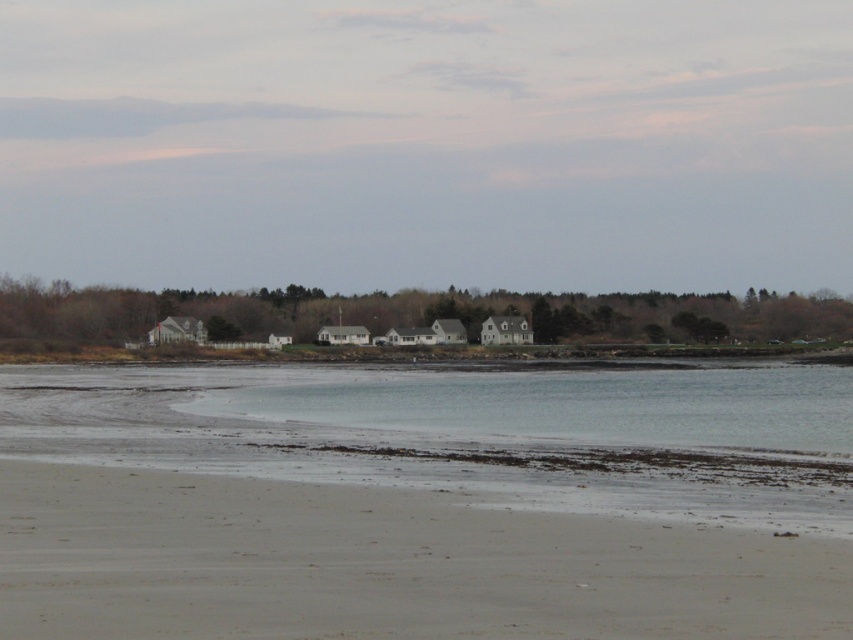
Question: Can you confirm if sandy beach at lower left is thinner than clear water at lower center?

Choices:
 (A) yes
 (B) no

Answer: (A)

Question: Does sandy beach at lower left appear over clear water at lower center?

Choices:
 (A) yes
 (B) no

Answer: (A)

Question: Which point is closer to the camera?

Choices:
 (A) clear water at lower center
 (B) sandy beach at lower left

Answer: (B)

Question: Does sandy beach at lower left have a lesser width compared to clear water at lower center?

Choices:
 (A) no
 (B) yes

Answer: (B)